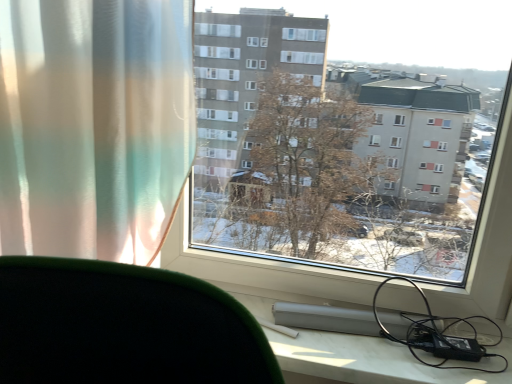
Question: Is transparent glass window at center positioned beyond the bounds of translucent fabric curtain at left?

Choices:
 (A) no
 (B) yes

Answer: (B)

Question: Does transparent glass window at center turn towards translucent fabric curtain at left?

Choices:
 (A) yes
 (B) no

Answer: (B)

Question: Can you confirm if transparent glass window at center is shorter than translucent fabric curtain at left?

Choices:
 (A) no
 (B) yes

Answer: (A)

Question: Is transparent glass window at center to the left of translucent fabric curtain at left from the viewer's perspective?

Choices:
 (A) no
 (B) yes

Answer: (A)

Question: From the image's perspective, is transparent glass window at center under translucent fabric curtain at left?

Choices:
 (A) no
 (B) yes

Answer: (A)

Question: From a real-world perspective, relative to transparent glass window at center, is black rubber cable at lower right vertically above or below?

Choices:
 (A) above
 (B) below

Answer: (B)

Question: Is black rubber cable at lower right bigger or smaller than transparent glass window at center?

Choices:
 (A) small
 (B) big

Answer: (A)

Question: From the image's perspective, relative to transparent glass window at center, is black rubber cable at lower right above or below?

Choices:
 (A) below
 (B) above

Answer: (A)

Question: Choose the correct answer: Is black rubber cable at lower right inside transparent glass window at center or outside it?

Choices:
 (A) inside
 (B) outside

Answer: (A)

Question: Is point tap(216, 56) positioned closer to the camera than point tap(456, 354)?

Choices:
 (A) farther
 (B) closer

Answer: (A)

Question: In the image, is transparent glass window at center on the left side or the right side of black rubber cable at lower right?

Choices:
 (A) right
 (B) left

Answer: (B)

Question: From the image's perspective, relative to black rubber cable at lower right, is transparent glass window at center above or below?

Choices:
 (A) below
 (B) above

Answer: (B)

Question: Is transparent glass window at center inside the boundaries of black rubber cable at lower right, or outside?

Choices:
 (A) inside
 (B) outside

Answer: (B)

Question: From the image's perspective, is translucent fabric curtain at left positioned above or below black rubber cable at lower right?

Choices:
 (A) above
 (B) below

Answer: (A)

Question: Is translucent fabric curtain at left in front of or behind black rubber cable at lower right in the image?

Choices:
 (A) behind
 (B) front

Answer: (B)